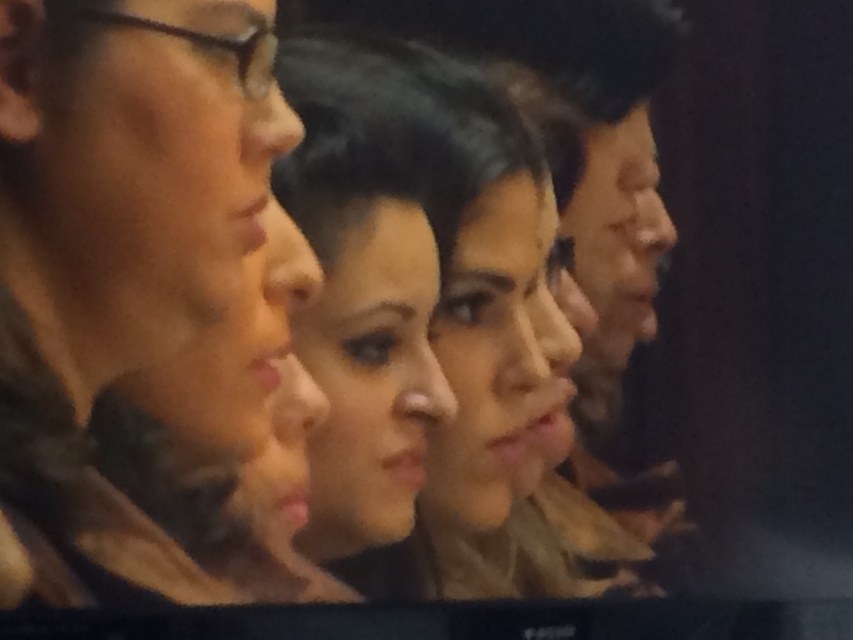
Can you confirm if matte brown hair at center is positioned to the left of smooth brown hair at center?

Indeed, matte brown hair at center is positioned on the left side of smooth brown hair at center.

Locate an element on the screen. The height and width of the screenshot is (640, 853). matte brown hair at center is located at coordinates (x=151, y=304).

Between point (138, 586) and point (476, 150), which one is positioned behind?

Point (476, 150)

The height and width of the screenshot is (640, 853). Identify the location of matte brown hair at center. (151, 304).